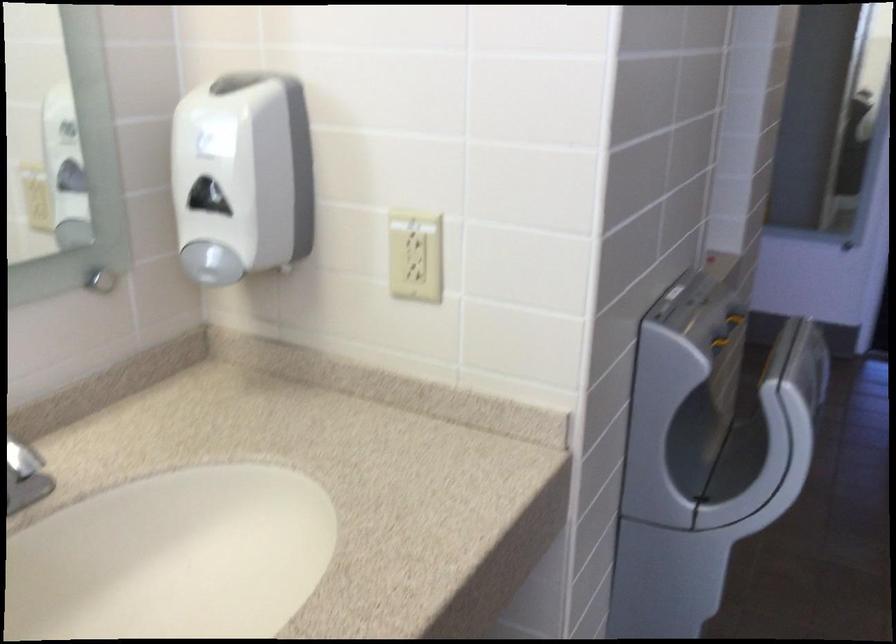
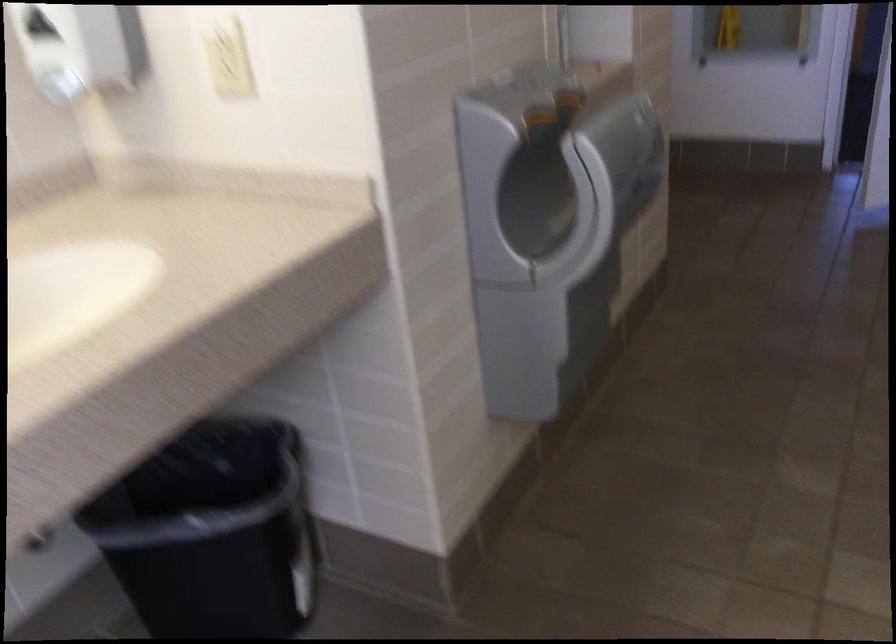
Question: Based on the continuous images, in which direction is the camera rotating? Reply with the corresponding letter.

Choices:
 (A) Left
 (B) Right
 (C) Up
 (D) Down

Answer: (D)